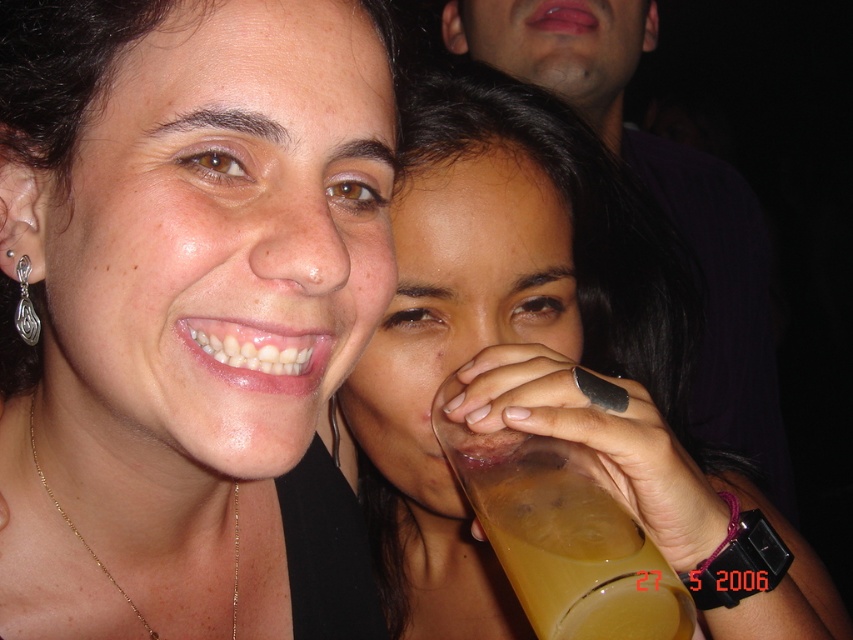
Measure the distance between point (0,285) and camera.

Point (0,285) and camera are 20.31 inches apart.

At what (x,y) coordinates should I click in order to perform the action: click on matte black necklace at center. Please return your answer as a coordinate pair (x, y). Image resolution: width=853 pixels, height=640 pixels. Looking at the image, I should click on (186, 312).

Measure the distance between point (22, 161) and camera.

Point (22, 161) is 15.83 inches from camera.

Which is more to the right, matte black necklace at center or gold chain at lower center?

matte black necklace at center is more to the right.

This screenshot has height=640, width=853. What do you see at coordinates (186, 312) in the screenshot?
I see `matte black necklace at center` at bounding box center [186, 312].

This screenshot has height=640, width=853. What are the coordinates of `matte black necklace at center` in the screenshot? It's located at (186, 312).

Does translucent plastic cup at center lie in front of gold chain at lower center?

Yes, translucent plastic cup at center is in front of gold chain at lower center.

Between translucent plastic cup at center and gold chain at lower center, which one has less height?

gold chain at lower center

Does point (517, 102) lie behind point (236, 522)?

That is True.

What are the coordinates of `translucent plastic cup at center` in the screenshot? It's located at (540, 362).